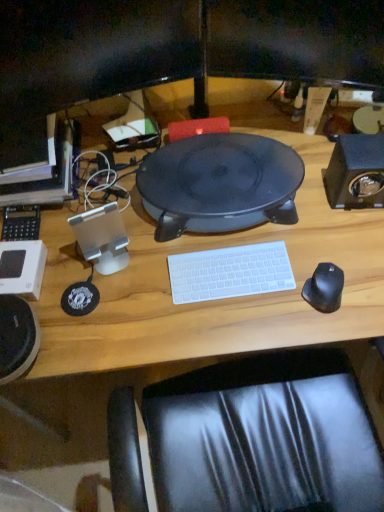
Where is `free space to the left of black matte speaker at center`? Image resolution: width=384 pixels, height=512 pixels. free space to the left of black matte speaker at center is located at coordinates (94, 202).